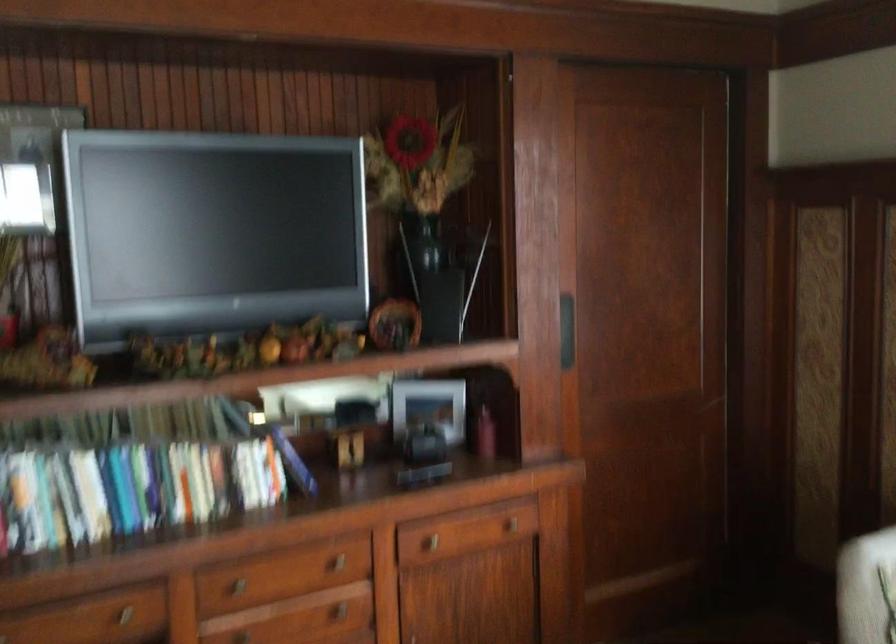
Where would you lift the silver picture frame? Please return your answer as a coordinate pair (x, y).

(428, 406)